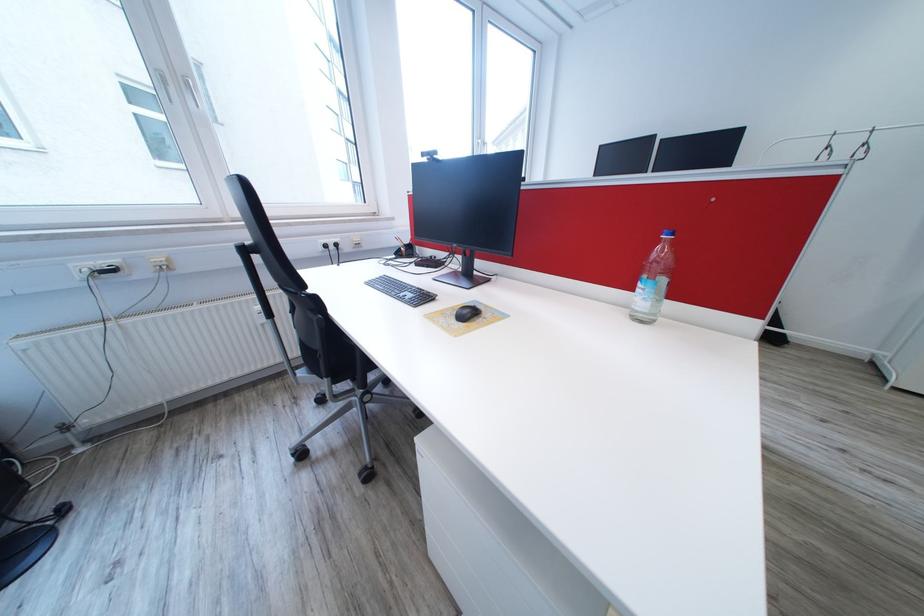
Identify the location of black chair armrest. click(245, 254).